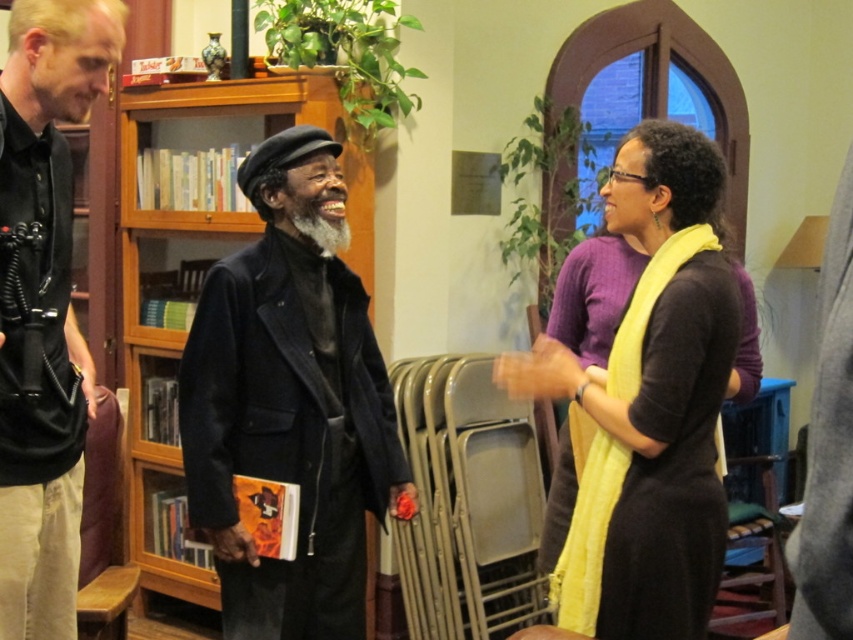
You are a tailor who needs to deliver a jacket to a customer. You see two jackets in the image, a matte black jacket at center and a black leather jacket at left. Which jacket is located to the right of the other?

The matte black jacket at center is positioned on the right side of the black leather jacket at left.

You are a visitor in this room and want to place a small potted plant on the wooden at left. However, there is already a black leather jacket at left on top of it. Can you put the plant there without moving the jacket?

The black leather jacket at left is located above wooden at left, meaning the jacket is on top of the wooden surface. Therefore, you cannot place the plant there without moving the jacket.

You are a tailor measuring jackets for alterations. You need to determine if the space between the matte black jacket at center and the black leather jacket at left is sufficient to place a 17 inch wide tailor dummy. Can the dummy fit between them?

The distance between the matte black jacket at center and the black leather jacket at left is 18.18 inches, which is wider than the 17 inch wide tailor dummy. Therefore, the dummy can fit between them.